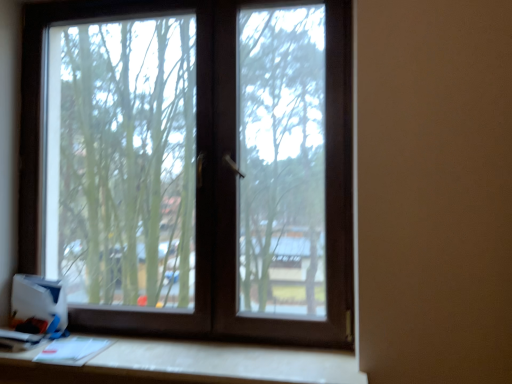
Question: Does brown matte window at center have a larger size compared to white matte table at lower center?

Choices:
 (A) yes
 (B) no

Answer: (A)

Question: From a real-world perspective, is brown matte window at center located higher than white matte table at lower center?

Choices:
 (A) no
 (B) yes

Answer: (B)

Question: From a real-world perspective, is brown matte window at center located beneath white matte table at lower center?

Choices:
 (A) no
 (B) yes

Answer: (A)

Question: Is brown matte window at center positioned with its back to white matte table at lower center?

Choices:
 (A) yes
 (B) no

Answer: (B)

Question: Does brown matte window at center have a greater width compared to white matte table at lower center?

Choices:
 (A) no
 (B) yes

Answer: (A)

Question: From the image's perspective, is white cardboard box at lower left located above or below white matte table at lower center?

Choices:
 (A) above
 (B) below

Answer: (A)

Question: In terms of size, does white cardboard box at lower left appear bigger or smaller than white matte table at lower center?

Choices:
 (A) big
 (B) small

Answer: (B)

Question: Would you say white cardboard box at lower left is inside or outside white matte table at lower center?

Choices:
 (A) inside
 (B) outside

Answer: (B)

Question: From their relative heights in the image, would you say white cardboard box at lower left is taller or shorter than white matte table at lower center?

Choices:
 (A) tall
 (B) short

Answer: (A)

Question: From a real-world perspective, is white matte table at lower center above or below brown matte window at center?

Choices:
 (A) above
 (B) below

Answer: (B)

Question: Based on their sizes in the image, would you say white matte table at lower center is bigger or smaller than brown matte window at center?

Choices:
 (A) small
 (B) big

Answer: (A)

Question: Would you say white matte table at lower center is to the left or to the right of brown matte window at center in the picture?

Choices:
 (A) left
 (B) right

Answer: (A)

Question: In terms of height, does white matte table at lower center look taller or shorter compared to brown matte window at center?

Choices:
 (A) tall
 (B) short

Answer: (B)

Question: Looking at their shapes, would you say white matte table at lower center is wider or thinner than white cardboard box at lower left?

Choices:
 (A) thin
 (B) wide

Answer: (B)

Question: In terms of height, does white matte table at lower center look taller or shorter compared to white cardboard box at lower left?

Choices:
 (A) short
 (B) tall

Answer: (A)